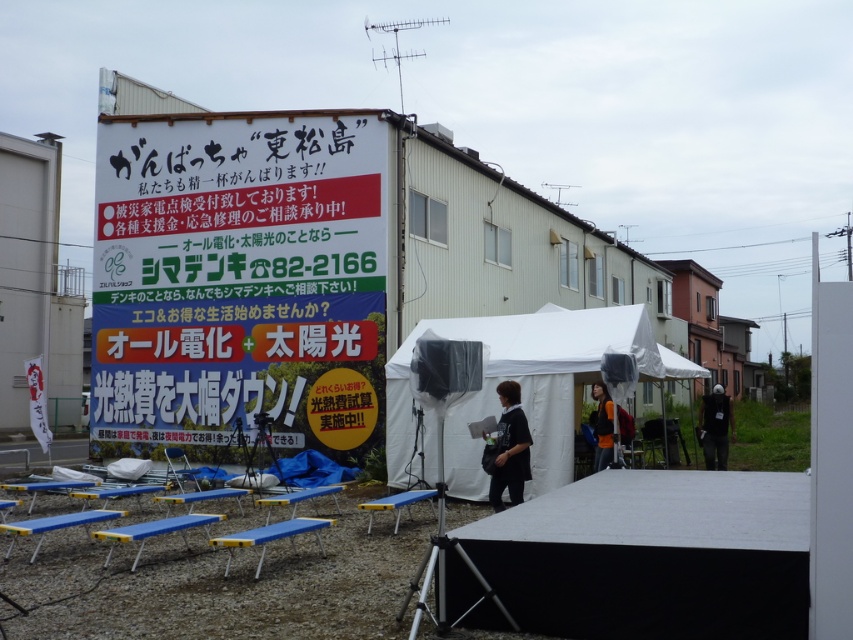
Question: Where is white fabric canopy at center located in relation to dark gray fabric bag at center in the image?

Choices:
 (A) left
 (B) right

Answer: (A)

Question: Considering the relative positions of white paperboard sign at upper center and orange fabric jacket at center in the image provided, where is white paperboard sign at upper center located with respect to orange fabric jacket at center?

Choices:
 (A) right
 (B) left

Answer: (B)

Question: Which point appears closest to the camera in this image?

Choices:
 (A) (599, 397)
 (B) (231, 152)
 (C) (495, 486)

Answer: (C)

Question: Which object appears farthest from the camera in this image?

Choices:
 (A) white paperboard sign at upper center
 (B) dark gray fabric bag at center
 (C) orange fabric jacket at center
 (D) dark green fabric jacket at lower right

Answer: (D)

Question: Which object appears closest to the camera in this image?

Choices:
 (A) dark gray fabric bag at center
 (B) white fabric canopy at center

Answer: (A)

Question: Does dark gray fabric bag at center have a larger size compared to orange fabric jacket at center?

Choices:
 (A) yes
 (B) no

Answer: (A)